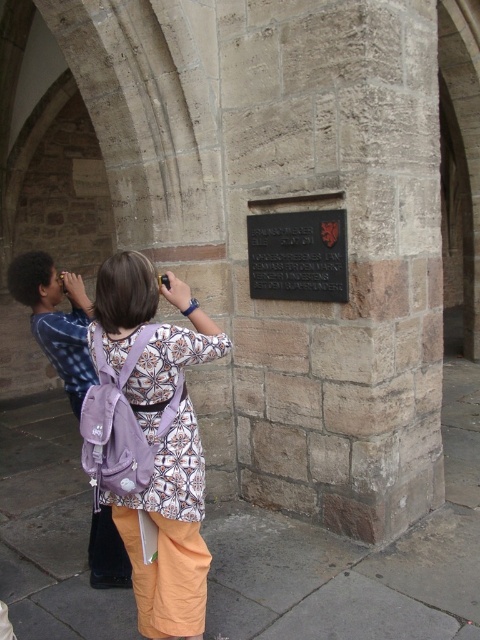
Is the position of purple fabric backpack at center less distant than that of black polished stone plaque at center?

That is True.

Does point (108, 484) come behind point (340, 246)?

No.

Where is `purple fabric backpack at center`? purple fabric backpack at center is located at coordinates (151, 440).

Measure the distance from purple fabric backpack at center to blue plaid shirt at left.

They are 76.00 centimeters apart.

Who is lower down, purple fabric backpack at center or blue plaid shirt at left?

Positioned lower is purple fabric backpack at center.

Find the location of a particular element. Image resolution: width=480 pixels, height=640 pixels. purple fabric backpack at center is located at coordinates (151, 440).

Can you confirm if blue plaid shirt at left is positioned below black polished stone plaque at center?

Yes, blue plaid shirt at left is below black polished stone plaque at center.

What do you see at coordinates (57, 320) in the screenshot?
I see `blue plaid shirt at left` at bounding box center [57, 320].

The height and width of the screenshot is (640, 480). I want to click on blue plaid shirt at left, so (x=57, y=320).